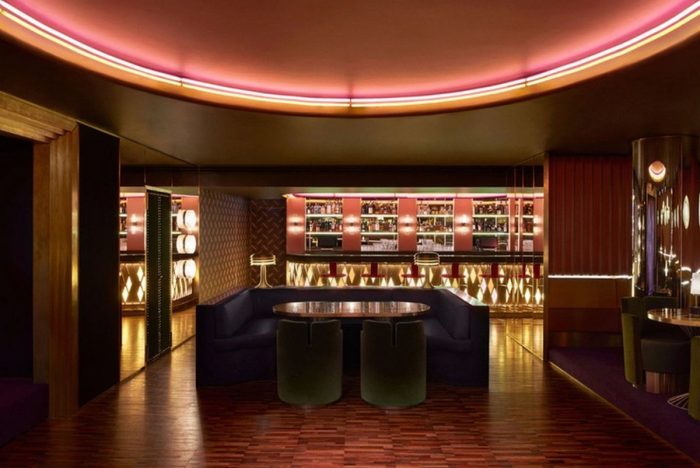
Locate an element on the screen. middle darker ceiling area is located at coordinates (342, 20).